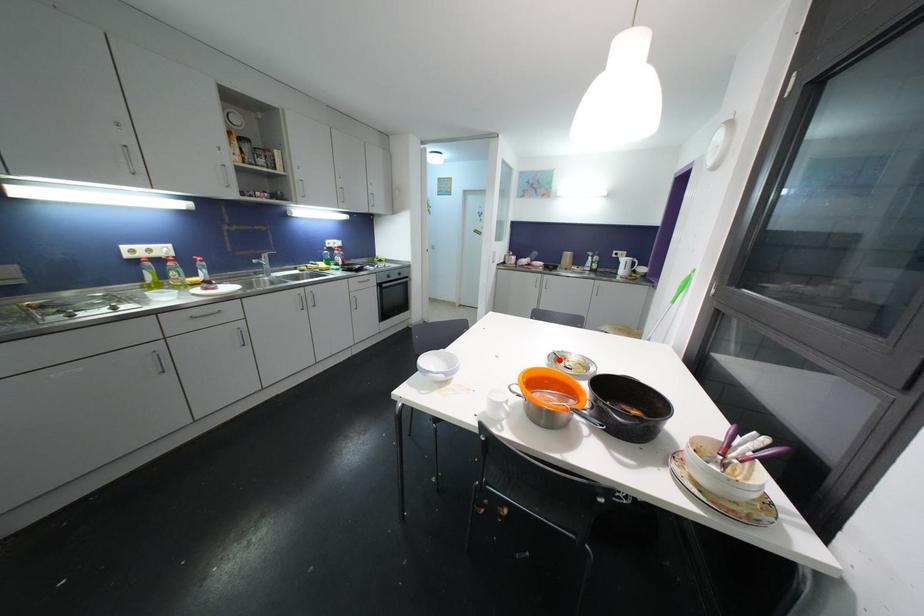
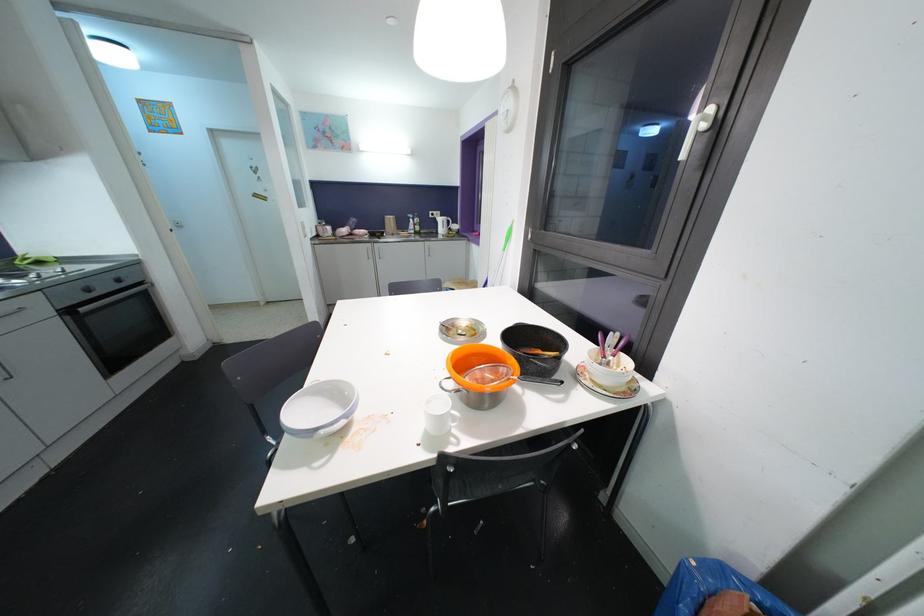
Question: I am providing you with two images of the same scene from different viewpoints. A red point is shown in image1. For the corresponding object point in image2, is it positioned nearer or farther from the camera?

Choices:
 (A) Nearer
 (B) Farther

Answer: (A)